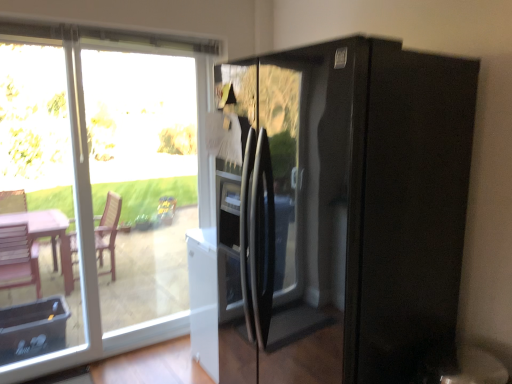
Question: Is transparent glass door at left, the first glass door from the left, aimed at transparent glass door at left, which appears as the 2th glass door when viewed from the left?

Choices:
 (A) no
 (B) yes

Answer: (A)

Question: Does transparent glass door at left, the first glass door from the left, have a lesser height compared to transparent glass door at left, which appears as the 2th glass door when viewed from the left?

Choices:
 (A) yes
 (B) no

Answer: (A)

Question: Would you say transparent glass door at left, which is the first glass door from right to left, is part of transparent glass door at left, the second glass door in the right-to-left sequence,'s contents?

Choices:
 (A) yes
 (B) no

Answer: (B)

Question: From the image's perspective, does transparent glass door at left, the first glass door from the left, appear lower than transparent glass door at left, which is the first glass door from right to left?

Choices:
 (A) no
 (B) yes

Answer: (B)

Question: Does transparent glass door at left, the second glass door in the right-to-left sequence, appear on the right side of transparent glass door at left, which appears as the 2th glass door when viewed from the left?

Choices:
 (A) no
 (B) yes

Answer: (A)

Question: From a real-world perspective, is transparent glass door at left, the second glass door in the right-to-left sequence, positioned under transparent glass door at left, which appears as the 2th glass door when viewed from the left, based on gravity?

Choices:
 (A) no
 (B) yes

Answer: (A)

Question: Is transparent glass door at left, which appears as the 2th glass door when viewed from the left, facing away from black glass refrigerator at right?

Choices:
 (A) no
 (B) yes

Answer: (A)

Question: Can you see transparent glass door at left, which is the first glass door from right to left, touching black glass refrigerator at right?

Choices:
 (A) yes
 (B) no

Answer: (B)

Question: Is transparent glass door at left, which appears as the 2th glass door when viewed from the left, not near black glass refrigerator at right?

Choices:
 (A) yes
 (B) no

Answer: (A)

Question: Can you confirm if transparent glass door at left, which is the first glass door from right to left, is smaller than black glass refrigerator at right?

Choices:
 (A) yes
 (B) no

Answer: (A)

Question: Is black glass refrigerator at right surrounded by transparent glass door at left, which appears as the 2th glass door when viewed from the left?

Choices:
 (A) no
 (B) yes

Answer: (A)

Question: From a real-world perspective, is transparent glass door at left, which appears as the 2th glass door when viewed from the left, on top of black glass refrigerator at right?

Choices:
 (A) no
 (B) yes

Answer: (B)

Question: Can you confirm if transparent glass door at left, the first glass door from the left, is smaller than transparent glass window at upper left?

Choices:
 (A) yes
 (B) no

Answer: (A)